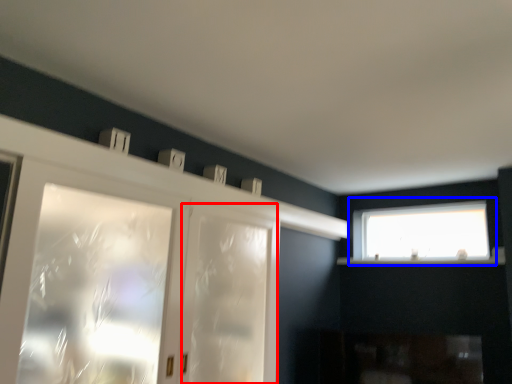
Question: Which object is closer to the camera taking this photo, screen door (highlighted by a red box) or window (highlighted by a blue box)?

Choices:
 (A) screen door
 (B) window

Answer: (A)